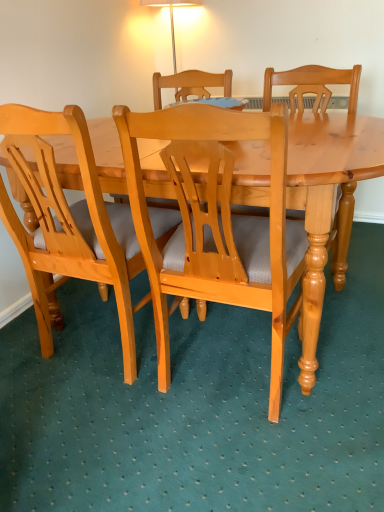
Question: Which direction should I rotate to look at matte wood chair at center, the 2th chair in the right-to-left sequence?

Choices:
 (A) left
 (B) right

Answer: (A)

Question: Should I look upward or downward to see light brown wood chair at center, placed as the second chair when sorted from left to right?

Choices:
 (A) up
 (B) down

Answer: (A)

Question: Does matte wood chair at center, the 2th chair in the right-to-left sequence, have a larger size compared to light brown wood chair at center, placed as the second chair when sorted from left to right?

Choices:
 (A) yes
 (B) no

Answer: (B)

Question: Does matte wood chair at center, which is the 1th chair from left to right, have a greater height compared to light brown wood chair at center, positioned as the first chair in right-to-left order?

Choices:
 (A) yes
 (B) no

Answer: (B)

Question: From the image's perspective, is matte wood chair at center, the 2th chair in the right-to-left sequence, over light brown wood chair at center, placed as the second chair when sorted from left to right?

Choices:
 (A) yes
 (B) no

Answer: (A)

Question: Is matte wood chair at center, the 2th chair in the right-to-left sequence, completely or partially outside of light brown wood chair at center, placed as the second chair when sorted from left to right?

Choices:
 (A) no
 (B) yes

Answer: (B)

Question: Would you say light brown wood chair at center, placed as the second chair when sorted from left to right, is part of matte wood chair at center, the 2th chair in the right-to-left sequence,'s contents?

Choices:
 (A) yes
 (B) no

Answer: (B)

Question: Can you confirm if matte wood chair at center, which is the 1th chair from left to right, is thinner than light brown wood chair at center, placed as the second chair when sorted from left to right?

Choices:
 (A) yes
 (B) no

Answer: (A)

Question: Considering the relative sizes of light brown wood chair at center, placed as the second chair when sorted from left to right, and matte wood chair at center, which is the 1th chair from left to right, in the image provided, is light brown wood chair at center, placed as the second chair when sorted from left to right, thinner than matte wood chair at center, which is the 1th chair from left to right,?

Choices:
 (A) no
 (B) yes

Answer: (A)

Question: From a real-world perspective, is light brown wood chair at center, positioned as the first chair in right-to-left order, over matte wood chair at center, the 2th chair in the right-to-left sequence?

Choices:
 (A) no
 (B) yes

Answer: (A)

Question: From the image's perspective, is light brown wood chair at center, positioned as the first chair in right-to-left order, beneath matte wood chair at center, the 2th chair in the right-to-left sequence?

Choices:
 (A) yes
 (B) no

Answer: (A)

Question: From the image's perspective, would you say light brown wood chair at center, placed as the second chair when sorted from left to right, is positioned over matte wood chair at center, which is the 1th chair from left to right?

Choices:
 (A) yes
 (B) no

Answer: (B)

Question: Can you confirm if light brown wood chair at center, positioned as the first chair in right-to-left order, is taller than matte wood chair at center, the 2th chair in the right-to-left sequence?

Choices:
 (A) no
 (B) yes

Answer: (B)

Question: Considering the relative positions of light brown wood chair at center, positioned as the first chair in right-to-left order, and matte wood chair at center, which is the 1th chair from left to right, in the image provided, is light brown wood chair at center, positioned as the first chair in right-to-left order, in front of matte wood chair at center, which is the 1th chair from left to right,?

Choices:
 (A) yes
 (B) no

Answer: (A)

Question: Relative to light brown wood chair at center, placed as the second chair when sorted from left to right, is matte wood chair at center, which is the 1th chair from left to right, in front or behind?

Choices:
 (A) behind
 (B) front

Answer: (A)